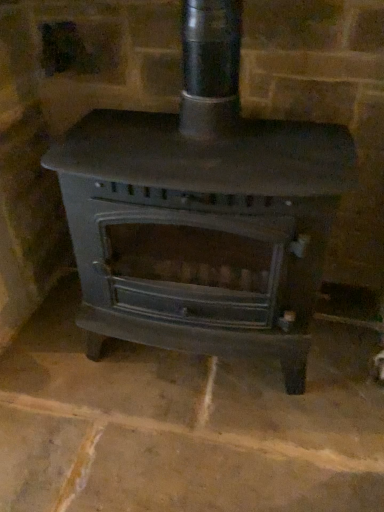
Where is `free spot in front of matte black wood burning stove at center`? The height and width of the screenshot is (512, 384). free spot in front of matte black wood burning stove at center is located at coordinates (192, 454).